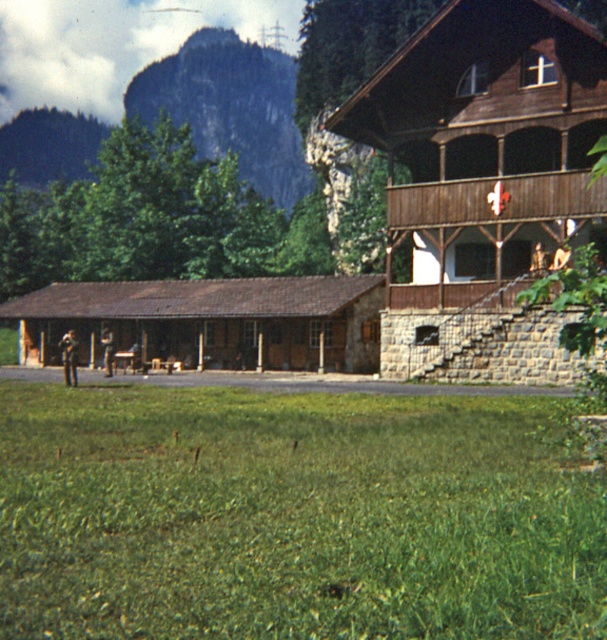
Is point (531, 518) closer to viewer compared to point (268, 67)?

Yes, point (531, 518) is closer to viewer.

Is point (327, 548) positioned before point (214, 92)?

Yes, it is.

The image size is (607, 640). What are the coordinates of `green grass at lower center` in the screenshot? It's located at (294, 515).